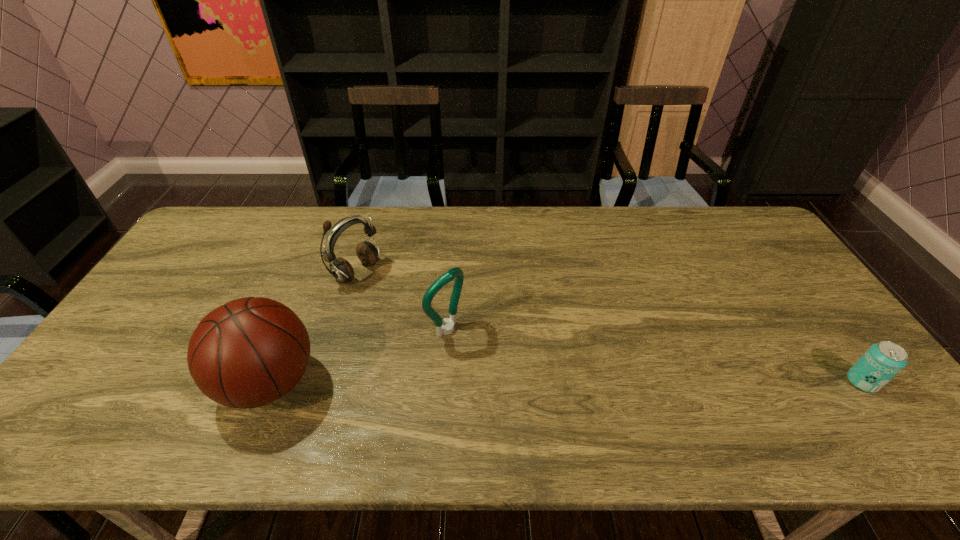
You are a GUI agent. You are given a task and a screenshot of the screen. Output one action in this format:
    pyautogui.click(x=<x>, y=<y>)
    Task: Click on the vacant space at the far left corner
    The width and height of the screenshot is (960, 540).
    Given the screenshot: What is the action you would take?
    pyautogui.click(x=232, y=246)

In the image, there is a desktop. Identify the location of vacant space at the near left corner. (108, 383).

Where is `vacant region at the far right corner`? This screenshot has height=540, width=960. vacant region at the far right corner is located at coordinates (737, 234).

Locate an element on the screen. The image size is (960, 540). vacant space that is in between the farthest object and the basketball is located at coordinates (313, 327).

Locate an element on the screen. The width and height of the screenshot is (960, 540). free spot between the basketball and the bottle opener is located at coordinates (358, 356).

At what (x,y) coordinates should I click in order to perform the action: click on free space between the basketball and the rightmost object. Please return your answer as a coordinate pair (x, y). The image size is (960, 540). Looking at the image, I should click on point(565,382).

Locate an element on the screen. unoccupied position between the rightmost object and the basketball is located at coordinates (565, 382).

Image resolution: width=960 pixels, height=540 pixels. Identify the location of unoccupied area between the bottle opener and the earphone. [402, 300].

Find the location of `empty location between the beer can and the earphone`. empty location between the beer can and the earphone is located at coordinates (610, 327).

Where is `free spot between the farthest object and the bottle opener`? free spot between the farthest object and the bottle opener is located at coordinates (402, 300).